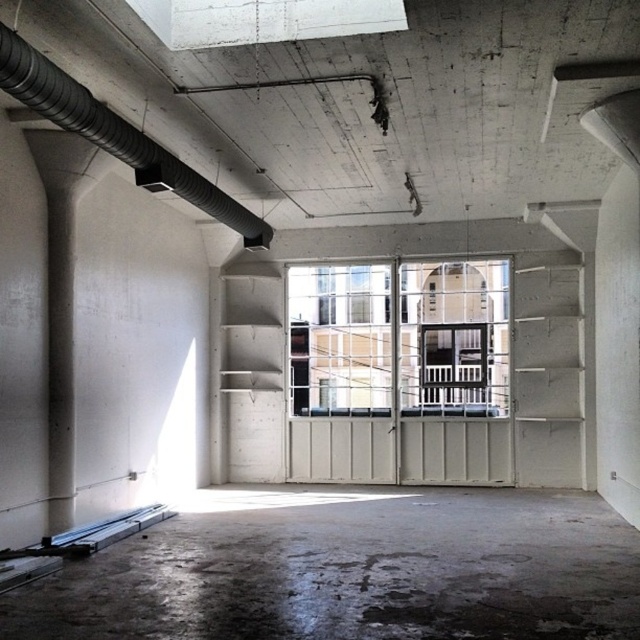
Question: Does concrete floor at center appear under clear glass window at center?

Choices:
 (A) no
 (B) yes

Answer: (B)

Question: Is concrete floor at center bigger than clear glass window at center?

Choices:
 (A) yes
 (B) no

Answer: (B)

Question: Which object appears farthest from the camera in this image?

Choices:
 (A) black rubber pipe at upper left
 (B) clear glass window at center

Answer: (B)

Question: Which point appears closest to the camera in this image?

Choices:
 (A) (140, 177)
 (B) (380, 355)

Answer: (A)

Question: Is concrete floor at center further to the viewer compared to black rubber pipe at upper left?

Choices:
 (A) yes
 (B) no

Answer: (A)

Question: Which object is farther from the camera taking this photo?

Choices:
 (A) clear glass window at center
 (B) black rubber pipe at upper left
 (C) concrete floor at center

Answer: (A)